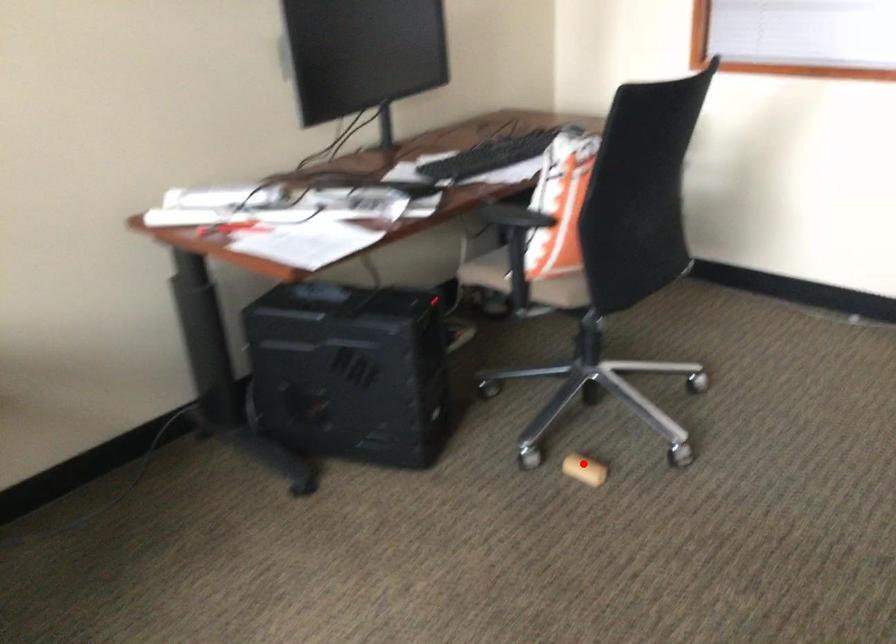
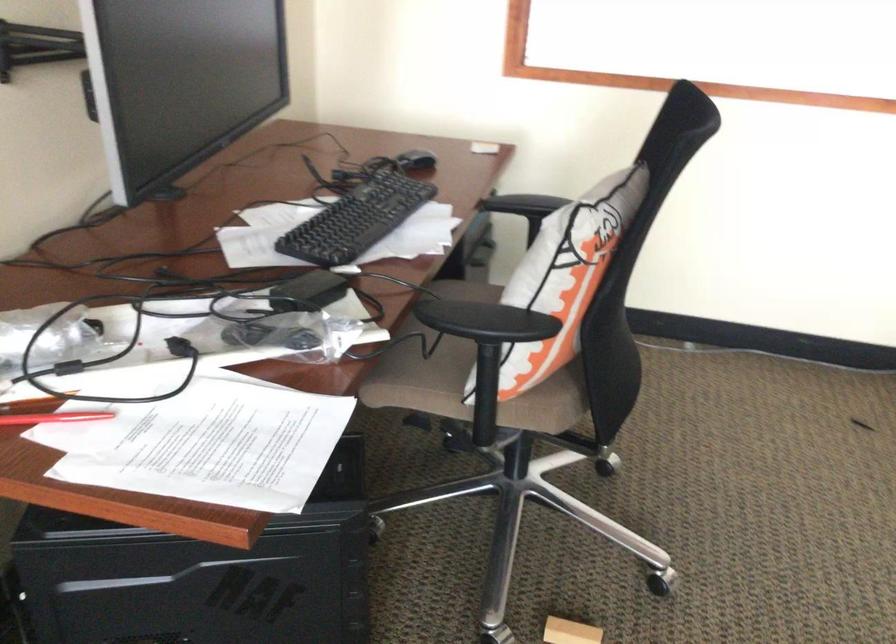
Question: I am providing you with two images of the same scene from different viewpoints. Image1 has a red point marked. In image2, the corresponding 3D location appears at what relative position? Reply with the corresponding letter.

Choices:
 (A) Closer
 (B) Farther

Answer: (A)